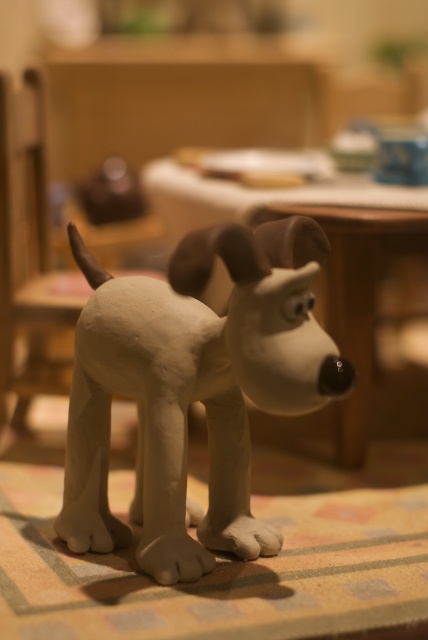
Who is higher up, white matte dog at center or wooden table at center?

wooden table at center is higher up.

Can you confirm if white matte dog at center is taller than wooden table at center?

No, white matte dog at center is not taller than wooden table at center.

Find the location of a particular element. white matte dog at center is located at coordinates point(190,388).

Does white matte dog at center appear on the left side of black matte nose at center?

Yes, white matte dog at center is to the left of black matte nose at center.

Does white matte dog at center have a lesser width compared to black matte nose at center?

Incorrect, white matte dog at center's width is not less than black matte nose at center's.

Find the location of a particular element. This screenshot has width=428, height=640. white matte dog at center is located at coordinates (190, 388).

Image resolution: width=428 pixels, height=640 pixels. What are the coordinates of `white matte dog at center` in the screenshot? It's located at (190, 388).

Is wooden table at center smaller than black matte nose at center?

No.

Can you confirm if wooden table at center is thinner than black matte nose at center?

No, wooden table at center is not thinner than black matte nose at center.

Which is in front, point (246, 221) or point (332, 378)?

Positioned in front is point (332, 378).

You are a GUI agent. You are given a task and a screenshot of the screen. Output one action in this format:
    pyautogui.click(x=<x>, y=<y>)
    Task: Click on the wooden table at center
    
    Given the screenshot: What is the action you would take?
    point(318,276)